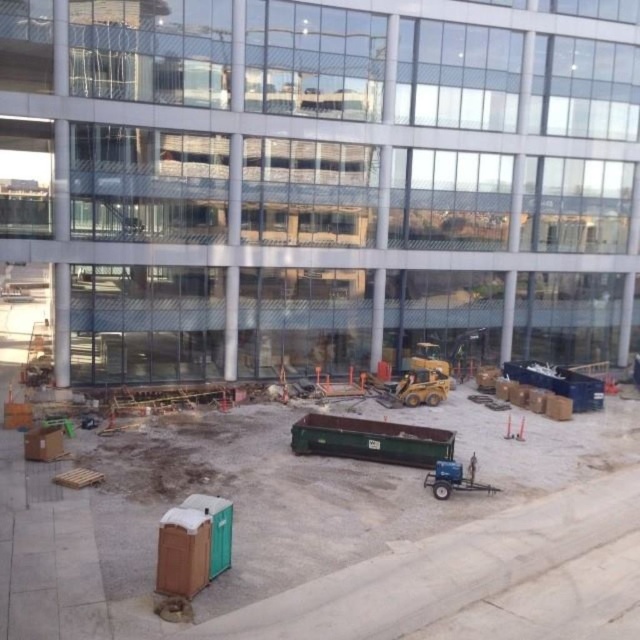
You are a delivery driver approaching the construction site. Your truck is 2 meters wide. There is a path between the transparent glass building at center and the blue metallic trailer at lower right. Can your truck pass through this path?

The transparent glass building at center is further to the viewer than the blue metallic trailer at lower right, so the path between them is narrow. Since the truck is 2 meters wide, it cannot pass through the path between the transparent glass building at center and the blue metallic trailer at lower right.

You are a construction worker standing at the edge of the construction site. You need to move a heavy tool from the green plastic container at lower center to the blue metallic trailer at lower right. Which object should you approach first to start moving the tool?

You should start at the green plastic container at lower center because it is closer to you than the blue metallic trailer at lower right.